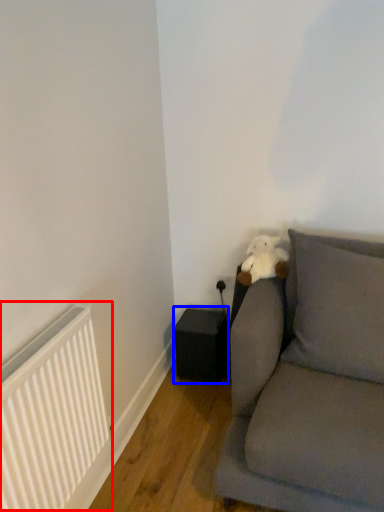
Question: Which point is closer to the camera, radiator (highlighted by a red box) or speaker (highlighted by a blue box)?

Choices:
 (A) radiator
 (B) speaker

Answer: (A)